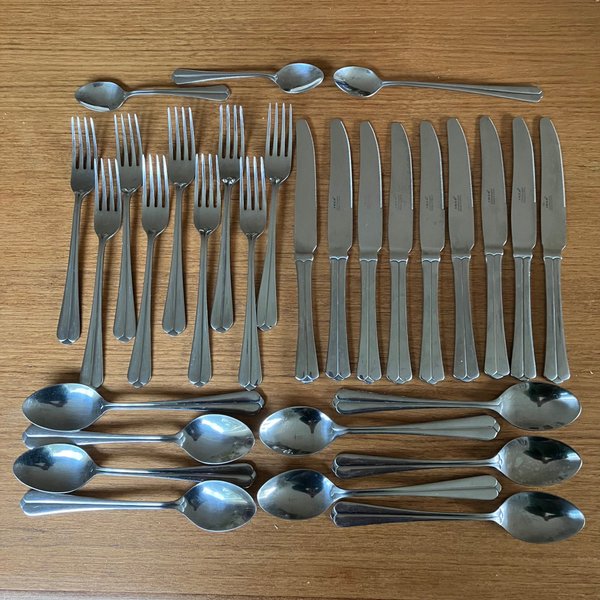
Where is `knives`? knives is located at coordinates (307, 313), (334, 318), (369, 348), (397, 361), (432, 360), (463, 361), (495, 361), (523, 361), (550, 360).